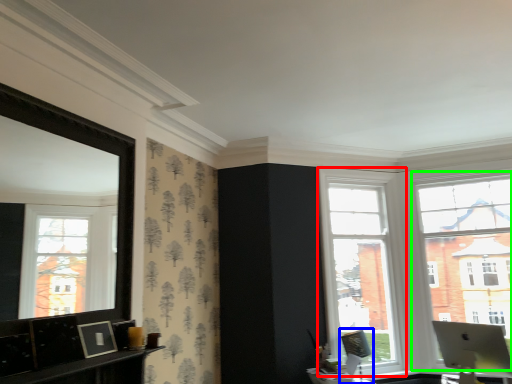
Question: Estimate the real-world distances between objects in this image. Which object is farther from window (highlighted by a red box), swivel chair (highlighted by a blue box) or window (highlighted by a green box)?

Choices:
 (A) swivel chair
 (B) window

Answer: (B)